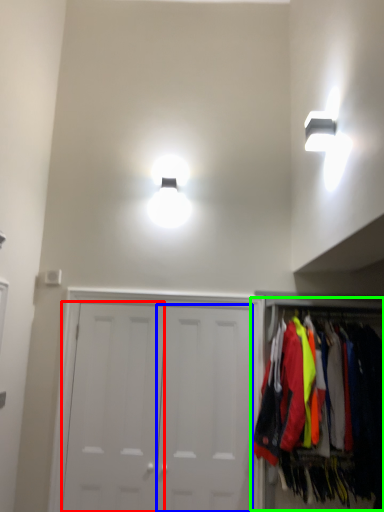
Question: Which object is the closest to the door (highlighted by a red box)? Choose among these: door (highlighted by a blue box) or closet (highlighted by a green box).

Choices:
 (A) door
 (B) closet

Answer: (A)